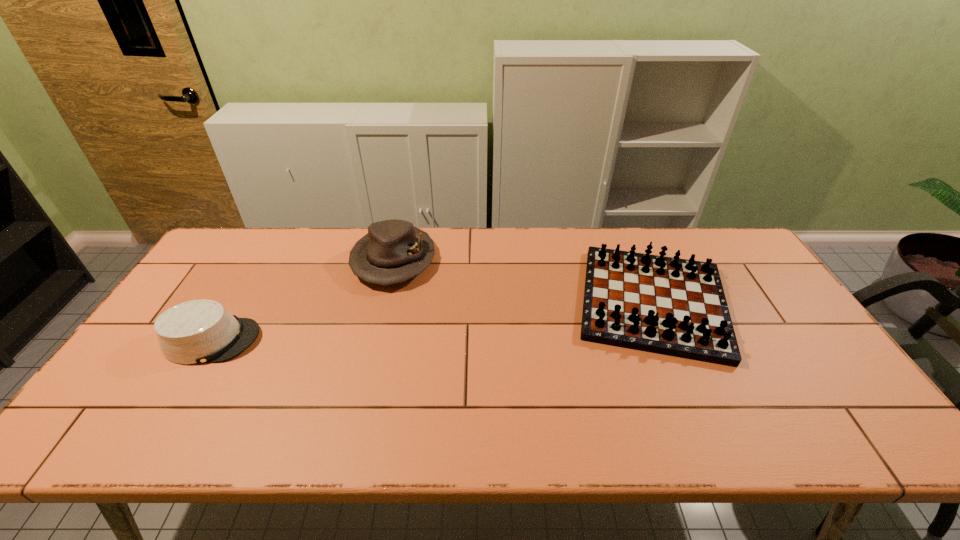
Locate an element on the screen. The width and height of the screenshot is (960, 540). the second closest object to the shortest object is located at coordinates (677, 307).

The height and width of the screenshot is (540, 960). What are the coordinates of `free point that satisfies the following two spatial constraints: 1. on the front side of the chessboard; 2. on the front-facing side of the shorter hat` in the screenshot? It's located at (668, 340).

Find the location of a particular element. vacant region that satisfies the following two spatial constraints: 1. on the decorative side of the farther hat; 2. on the front-facing side of the shorter hat is located at coordinates (374, 340).

In order to click on free space that satisfies the following two spatial constraints: 1. on the decorative side of the right hat; 2. on the front-facing side of the nearer hat in this screenshot , I will do `click(374, 340)`.

The height and width of the screenshot is (540, 960). Identify the location of free spot that satisfies the following two spatial constraints: 1. on the decorative side of the chessboard; 2. on the left side of the taller hat. (383, 302).

At what (x,y) coordinates should I click in order to perform the action: click on free space that satisfies the following two spatial constraints: 1. on the front side of the chessboard; 2. on the front-facing side of the shortest object. Please return your answer as a coordinate pair (x, y). Looking at the image, I should click on (668, 340).

This screenshot has width=960, height=540. I want to click on free space that satisfies the following two spatial constraints: 1. on the decorative side of the rightmost object; 2. on the right side of the second object from right to left, so click(x=383, y=302).

Find the location of a particular element. The height and width of the screenshot is (540, 960). blank area in the image that satisfies the following two spatial constraints: 1. on the decorative side of the right hat; 2. on the front-facing side of the nearer hat is located at coordinates (374, 340).